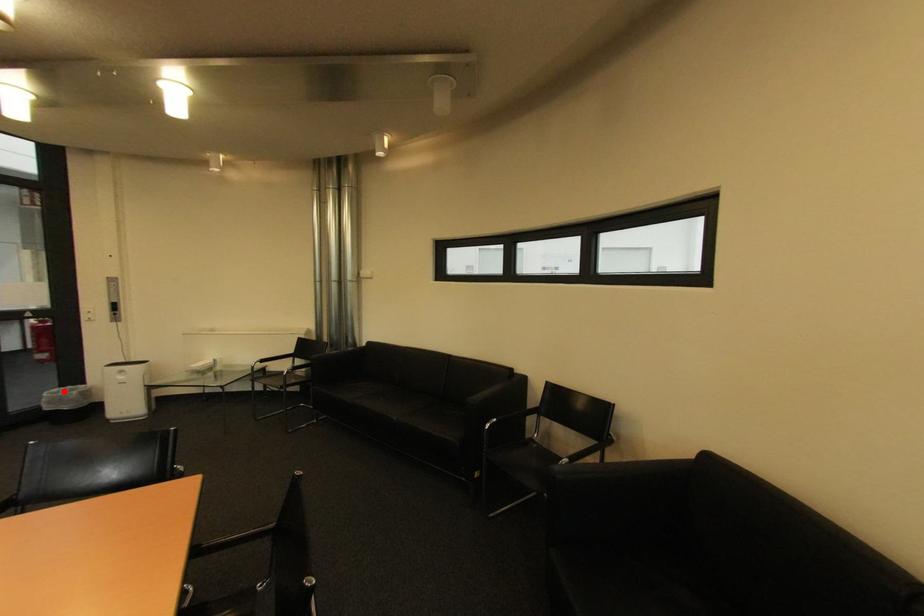
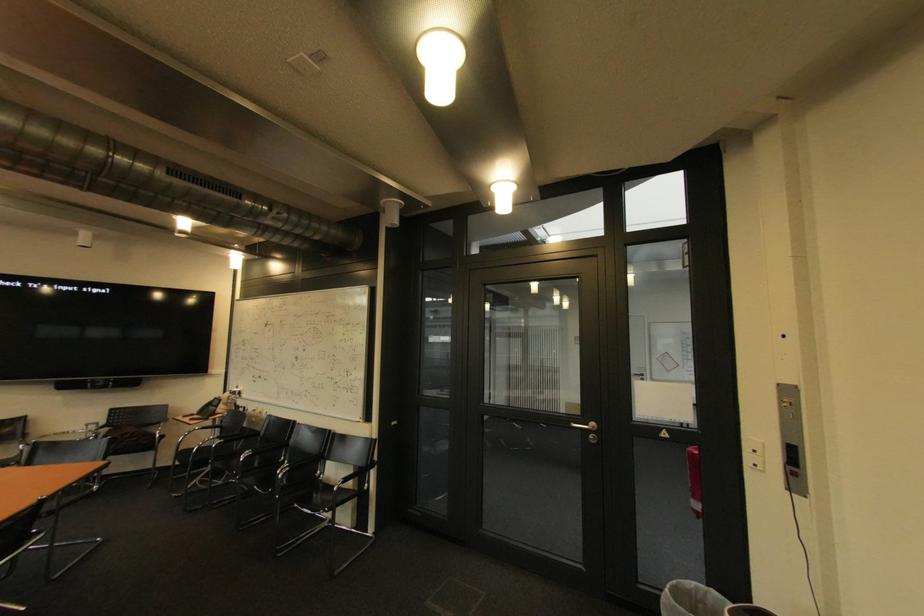
In the second image, find the point that corresponds to the highlighted location in the first image.

(701, 585)